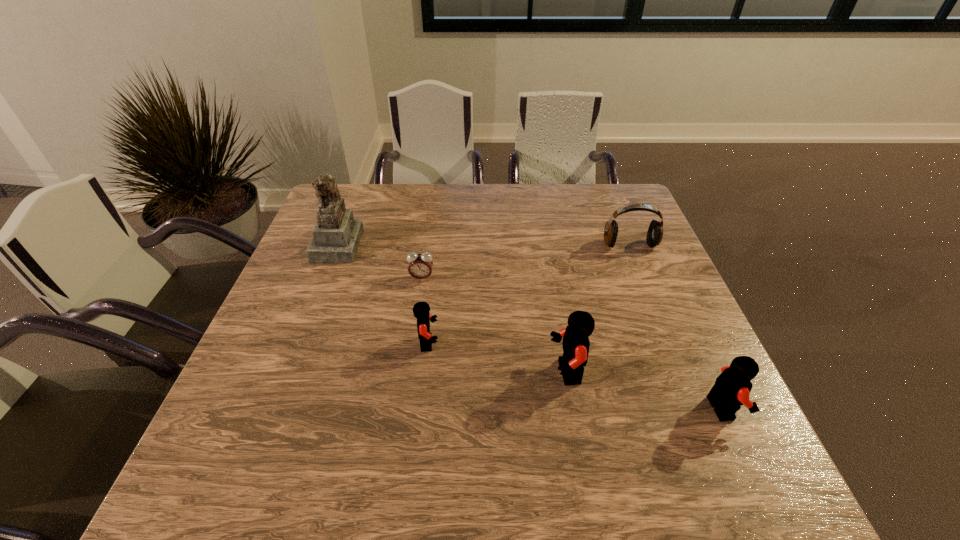
I want to click on vacant space located on the front-facing side of the second Lego from left to right, so click(403, 373).

Where is `vacant space located on the front-facing side of the second Lego from left to right`? vacant space located on the front-facing side of the second Lego from left to right is located at coordinates (469, 373).

Image resolution: width=960 pixels, height=540 pixels. What are the coordinates of `free region located 0.090m on the clock face of the shortest object` in the screenshot? It's located at (418, 307).

You are a GUI agent. You are given a task and a screenshot of the screen. Output one action in this format:
    pyautogui.click(x=<x>, y=<y>)
    Task: Click on the free space located 0.100m on the front-facing side of the figurine
    This screenshot has width=960, height=540.
    Given the screenshot: What is the action you would take?
    pyautogui.click(x=395, y=244)

At what (x,y) coordinates should I click in order to perform the action: click on free space located 0.390m on the ear cups of the headset. Please return your answer as a coordinate pair (x, y). Looking at the image, I should click on (679, 365).

Where is `object situated at the near edge`? The width and height of the screenshot is (960, 540). object situated at the near edge is located at coordinates (732, 388).

The height and width of the screenshot is (540, 960). I want to click on object located in the left edge section of the desktop, so click(336, 236).

Where is `Lego at the right edge`? Image resolution: width=960 pixels, height=540 pixels. Lego at the right edge is located at coordinates (732, 388).

This screenshot has width=960, height=540. I want to click on headset that is at the right edge, so click(x=654, y=236).

Where is `object positioned at the near right corner`? This screenshot has height=540, width=960. object positioned at the near right corner is located at coordinates (732, 388).